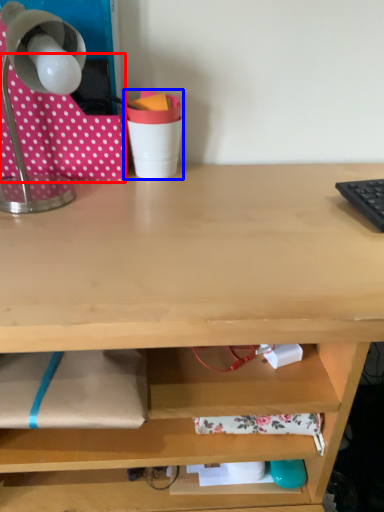
Question: Which object is closer to the camera taking this photo, fabric (highlighted by a red box) or stationery (highlighted by a blue box)?

Choices:
 (A) fabric
 (B) stationery

Answer: (A)